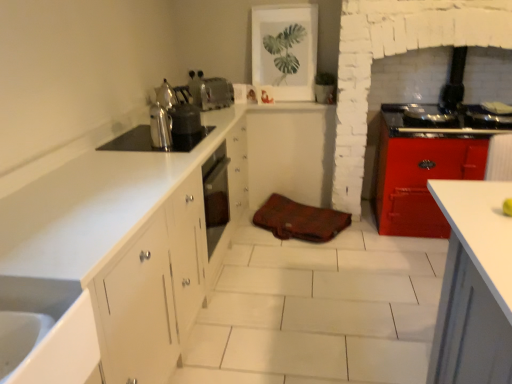
Find the location of `satin silver kettle at upper left, the third appliance in the back-to-front sequence`. satin silver kettle at upper left, the third appliance in the back-to-front sequence is located at coordinates (151, 140).

The width and height of the screenshot is (512, 384). What do you see at coordinates (166, 95) in the screenshot? I see `shiny metallic tea pot at upper left` at bounding box center [166, 95].

Locate an element on the screen. shiny metallic kettle at center-left is located at coordinates (162, 118).

Locate an element on the screen. satin silver toaster at upper center, the 1th appliance positioned from the back is located at coordinates (210, 91).

The image size is (512, 384). Describe the element at coordinates (184, 114) in the screenshot. I see `satin silver kettle at upper left, acting as the second appliance starting from the front` at that location.

This screenshot has height=384, width=512. Find the location of `satin silver kettle at upper left, acting as the second appliance starting from the back`. satin silver kettle at upper left, acting as the second appliance starting from the back is located at coordinates (184, 114).

The height and width of the screenshot is (384, 512). Describe the element at coordinates (298, 220) in the screenshot. I see `brown leather bag at center` at that location.

Locate an element on the screen. The image size is (512, 384). white matte cabinet at center is located at coordinates (291, 153).

Could you tell me if satin silver kettle at upper left, the 1th appliance in the front-to-back sequence, is facing shiny metallic tea pot at upper left?

No.

At what (x,y) coordinates should I click in order to perform the action: click on tea pot behind the satin silver kettle at upper left, the 1th appliance in the front-to-back sequence. Please return your answer as a coordinate pair (x, y). This screenshot has width=512, height=384. Looking at the image, I should click on (166, 95).

Would you say satin silver kettle at upper left, the 1th appliance in the front-to-back sequence, is inside or outside shiny metallic tea pot at upper left?

satin silver kettle at upper left, the 1th appliance in the front-to-back sequence, is spatially situated outside shiny metallic tea pot at upper left.

Does point (135, 145) appear closer or farther from the camera than point (165, 100)?

Point (135, 145) is closer to the camera than point (165, 100).

From a real-world perspective, is satin silver toaster at upper center, the 3th appliance from the front, located beneath satin silver kettle at upper left, acting as the second appliance starting from the back?

Indeed, from a real-world perspective, satin silver toaster at upper center, the 3th appliance from the front, is positioned beneath satin silver kettle at upper left, acting as the second appliance starting from the back.

From the picture: Is satin silver toaster at upper center, the 1th appliance positioned from the back, not within satin silver kettle at upper left, acting as the second appliance starting from the front?

Indeed, satin silver toaster at upper center, the 1th appliance positioned from the back, is completely outside satin silver kettle at upper left, acting as the second appliance starting from the front.

Considering the sizes of objects satin silver toaster at upper center, the 3th appliance from the front, and satin silver kettle at upper left, acting as the second appliance starting from the back, in the image provided, who is taller, satin silver toaster at upper center, the 3th appliance from the front, or satin silver kettle at upper left, acting as the second appliance starting from the back,?

satin silver kettle at upper left, acting as the second appliance starting from the back, is taller.

Considering the relative sizes of satin silver toaster at upper center, the 3th appliance from the front, and satin silver kettle at upper left, acting as the second appliance starting from the front, in the image provided, is satin silver toaster at upper center, the 3th appliance from the front, wider than satin silver kettle at upper left, acting as the second appliance starting from the front,?

Yes, satin silver toaster at upper center, the 3th appliance from the front, is wider than satin silver kettle at upper left, acting as the second appliance starting from the front.

Would you say satin silver toaster at upper center, the 1th appliance positioned from the back, is to the left or to the right of brown leather bag at center in the picture?

In the image, satin silver toaster at upper center, the 1th appliance positioned from the back, appears on the left side of brown leather bag at center.

Measure the distance between satin silver toaster at upper center, the 1th appliance positioned from the back, and brown leather bag at center.

3.62 feet.

Is point (201, 73) closer to viewer compared to point (284, 200)?

No, it is behind (284, 200).

Which object is wider, satin silver toaster at upper center, the 3th appliance from the front, or brown leather bag at center?

Wider between the two is brown leather bag at center.

Locate an element on the screen. The image size is (512, 384). kitchen appliance below the shiny metallic tea pot at upper left (from a real-world perspective) is located at coordinates (162, 118).

Is shiny metallic kettle at center-left in contact with shiny metallic tea pot at upper left?

shiny metallic kettle at center-left is not next to shiny metallic tea pot at upper left, and they're not touching.

From the image's perspective, is shiny metallic kettle at center-left positioned above or below shiny metallic tea pot at upper left?

From the image's perspective, shiny metallic kettle at center-left appears below shiny metallic tea pot at upper left.

Is shiny metallic tea pot at upper left at the back of shiny metallic kettle at center-left?

No.

In the image, there is a brown leather bag at center. In order to click on tea pot above it (from the image's perspective) in this screenshot , I will do `click(166, 95)`.

From the image's perspective, which object appears higher, brown leather bag at center or shiny metallic tea pot at upper left?

shiny metallic tea pot at upper left.

From their relative heights in the image, would you say brown leather bag at center is taller or shorter than shiny metallic tea pot at upper left?

In the image, brown leather bag at center appears to be shorter than shiny metallic tea pot at upper left.

Between brown leather bag at center and shiny metallic tea pot at upper left, which one has larger width?

With larger width is brown leather bag at center.

Consider the image. From the image's perspective, between satin silver kettle at upper left, the 1th appliance in the front-to-back sequence, and brown leather bag at center, who is located below?

brown leather bag at center is shown below in the image.

Who is more distant, satin silver kettle at upper left, the 1th appliance in the front-to-back sequence, or brown leather bag at center?

Positioned behind is brown leather bag at center.

In terms of width, does satin silver kettle at upper left, the third appliance in the back-to-front sequence, look wider or thinner when compared to brown leather bag at center?

Clearly, satin silver kettle at upper left, the third appliance in the back-to-front sequence, has more width compared to brown leather bag at center.

Considering the relative sizes of white matte cabinet at center and satin silver kettle at upper left, the 1th appliance in the front-to-back sequence, in the image provided, is white matte cabinet at center thinner than satin silver kettle at upper left, the 1th appliance in the front-to-back sequence,?

No, white matte cabinet at center is not thinner than satin silver kettle at upper left, the 1th appliance in the front-to-back sequence.

How distant is white matte cabinet at center from satin silver kettle at upper left, the third appliance in the back-to-front sequence?

The distance of white matte cabinet at center from satin silver kettle at upper left, the third appliance in the back-to-front sequence, is 1.02 meters.

Identify the location of cabinetry that appears above the satin silver kettle at upper left, the third appliance in the back-to-front sequence (from the image's perspective). (291, 153).

From a real-world perspective, is white matte cabinet at center above or below satin silver kettle at upper left, the 1th appliance in the front-to-back sequence?

white matte cabinet at center is below satin silver kettle at upper left, the 1th appliance in the front-to-back sequence.

Identify the location of the 2nd appliance in front of the shiny metallic tea pot at upper left, counting from the anchor's position. (151, 140).

From the image's perspective, count 1st appliances downward from the satin silver toaster at upper center, the 3th appliance from the front, and point to it. Please provide its 2D coordinates.

[(184, 114)]

When comparing their distances from satin silver kettle at upper left, the 1th appliance in the front-to-back sequence, does brown leather bag at center or satin silver toaster at upper center, the 1th appliance positioned from the back, seem further?

brown leather bag at center is further to satin silver kettle at upper left, the 1th appliance in the front-to-back sequence.

From the image, which object appears to be nearer to satin silver kettle at upper left, acting as the second appliance starting from the front, satin silver toaster at upper center, the 3th appliance from the front, or satin silver kettle at upper left, the third appliance in the back-to-front sequence?

satin silver kettle at upper left, the third appliance in the back-to-front sequence, is positioned closer to the anchor satin silver kettle at upper left, acting as the second appliance starting from the front.

Which object lies nearer to the anchor point satin silver kettle at upper left, the third appliance in the back-to-front sequence, shiny metallic kettle at center-left or brown leather bag at center?

Among the two, shiny metallic kettle at center-left is located nearer to satin silver kettle at upper left, the third appliance in the back-to-front sequence.

Considering their positions, is white matte cabinet at center positioned further to brown leather bag at center than shiny metallic tea pot at upper left?

Among the two, shiny metallic tea pot at upper left is located further to brown leather bag at center.

Based on their spatial positions, is white matte cabinet at center or satin silver toaster at upper center, the 3th appliance from the front, closer to satin silver kettle at upper left, the 1th appliance in the front-to-back sequence?

Based on the image, satin silver toaster at upper center, the 3th appliance from the front, appears to be nearer to satin silver kettle at upper left, the 1th appliance in the front-to-back sequence.

Based on the photo, looking at the image, which one is located closer to satin silver kettle at upper left, acting as the second appliance starting from the front, shiny metallic kettle at center-left or satin silver kettle at upper left, the third appliance in the back-to-front sequence?

Among the two, shiny metallic kettle at center-left is located nearer to satin silver kettle at upper left, acting as the second appliance starting from the front.

Which object lies further to the anchor point shiny metallic tea pot at upper left, white matte cabinet at center or shiny metallic kettle at center-left?

Among the two, white matte cabinet at center is located further to shiny metallic tea pot at upper left.

From the image, which object appears to be farther from satin silver kettle at upper left, acting as the second appliance starting from the back, satin silver kettle at upper left, the third appliance in the back-to-front sequence, or satin silver toaster at upper center, the 3th appliance from the front?

satin silver toaster at upper center, the 3th appliance from the front, lies further to satin silver kettle at upper left, acting as the second appliance starting from the back, than the other object.

You are a GUI agent. You are given a task and a screenshot of the screen. Output one action in this format:
    pyautogui.click(x=<x>, y=<y>)
    Task: Click on the material between shiny metallic kettle at center-left and satin silver toaster at upper center, the 3th appliance from the front, in the front-back direction
    The height and width of the screenshot is (384, 512).
    Given the screenshot: What is the action you would take?
    pyautogui.click(x=298, y=220)

Where is `appliance located between shiny metallic kettle at center-left and satin silver kettle at upper left, acting as the second appliance starting from the back, in the depth direction`? The width and height of the screenshot is (512, 384). appliance located between shiny metallic kettle at center-left and satin silver kettle at upper left, acting as the second appliance starting from the back, in the depth direction is located at coordinates (151, 140).

Find the location of a particular element. tea pot between satin silver kettle at upper left, the 1th appliance in the front-to-back sequence, and white matte cabinet at center from front to back is located at coordinates (166, 95).

This screenshot has height=384, width=512. What are the coordinates of `appliance located between satin silver kettle at upper left, the 1th appliance in the front-to-back sequence, and satin silver toaster at upper center, the 1th appliance positioned from the back, in the depth direction` in the screenshot? It's located at (184, 114).